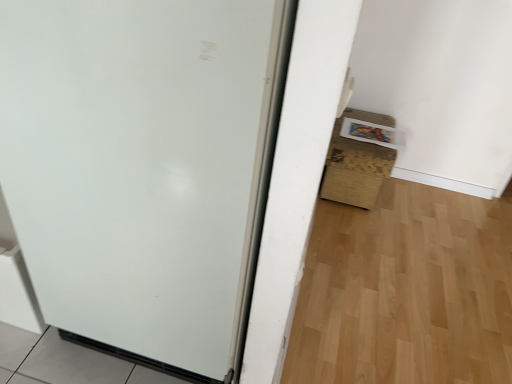
Question: From the image's perspective, is brown cardboard box at lower right located above or below white matte door at center?

Choices:
 (A) below
 (B) above

Answer: (B)

Question: Looking at their shapes, would you say brown cardboard box at lower right is wider or thinner than white matte door at center?

Choices:
 (A) wide
 (B) thin

Answer: (B)

Question: Would you say brown cardboard box at lower right is inside or outside white matte door at center?

Choices:
 (A) inside
 (B) outside

Answer: (B)

Question: Choose the correct answer: Is white matte door at center inside brown cardboard box at lower right or outside it?

Choices:
 (A) inside
 (B) outside

Answer: (B)

Question: Based on their sizes in the image, would you say white matte door at center is bigger or smaller than brown cardboard box at lower right?

Choices:
 (A) small
 (B) big

Answer: (B)

Question: From a real-world perspective, is white matte door at center physically located above or below brown cardboard box at lower right?

Choices:
 (A) above
 (B) below

Answer: (A)

Question: Considering the relative positions of white matte door at center and brown cardboard box at lower right in the image provided, is white matte door at center to the left or to the right of brown cardboard box at lower right?

Choices:
 (A) right
 (B) left

Answer: (B)